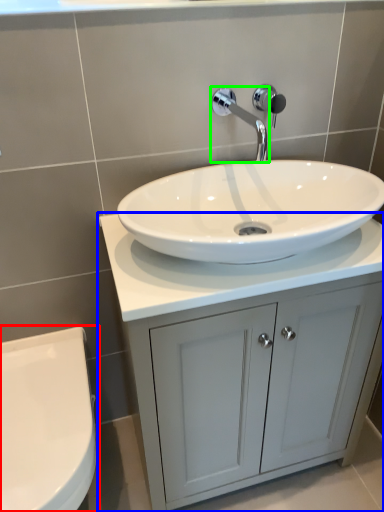
Question: Which is nearer to the toilet (highlighted by a red box)? bathroom cabinet (highlighted by a blue box) or tap (highlighted by a green box).

Choices:
 (A) bathroom cabinet
 (B) tap

Answer: (A)